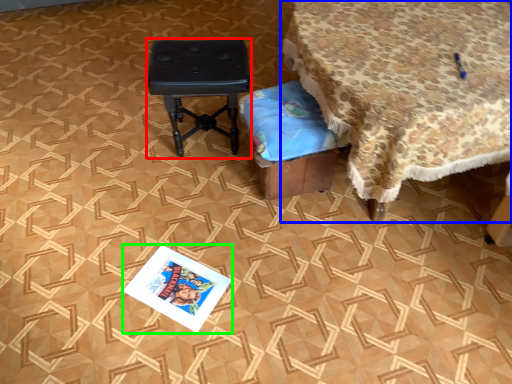
Question: Which object is positioned closest to stool (highlighted by a red box)? Select from table (highlighted by a blue box) and magazine (highlighted by a green box).

Choices:
 (A) table
 (B) magazine

Answer: (A)